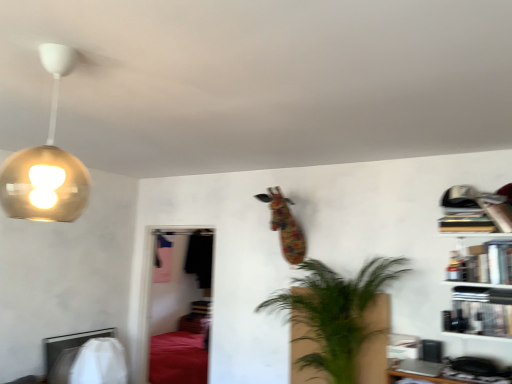
Question: Is gold metallic globe at upper left surrounded by metallic silver book at right, placed as the 1th book when sorted from bottom to top?

Choices:
 (A) yes
 (B) no

Answer: (B)

Question: Are metallic silver book at right, placed as the 1th book when sorted from bottom to top, and gold metallic globe at upper left located far from each other?

Choices:
 (A) no
 (B) yes

Answer: (B)

Question: Is gold metallic globe at upper left at the back of metallic silver book at right, placed as the 1th book when sorted from bottom to top?

Choices:
 (A) no
 (B) yes

Answer: (A)

Question: Does metallic silver book at right, placed as the 3th book when sorted from top to bottom, have a lesser height compared to gold metallic globe at upper left?

Choices:
 (A) yes
 (B) no

Answer: (A)

Question: From a real-world perspective, is metallic silver book at right, placed as the 1th book when sorted from bottom to top, over gold metallic globe at upper left?

Choices:
 (A) yes
 (B) no

Answer: (B)

Question: Can you confirm if metallic silver book at right, placed as the 3th book when sorted from top to bottom, is taller than gold metallic globe at upper left?

Choices:
 (A) no
 (B) yes

Answer: (A)

Question: From a real-world perspective, is metallic silver book at right, placed as the 3th book when sorted from top to bottom, physically below green leafy plant at center?

Choices:
 (A) yes
 (B) no

Answer: (B)

Question: Can you confirm if metallic silver book at right, placed as the 3th book when sorted from top to bottom, is shorter than green leafy plant at center?

Choices:
 (A) yes
 (B) no

Answer: (A)

Question: Is metallic silver book at right, placed as the 1th book when sorted from bottom to top, with green leafy plant at center?

Choices:
 (A) no
 (B) yes

Answer: (A)

Question: Does metallic silver book at right, placed as the 3th book when sorted from top to bottom, come in front of green leafy plant at center?

Choices:
 (A) no
 (B) yes

Answer: (A)

Question: Are metallic silver book at right, placed as the 3th book when sorted from top to bottom, and green leafy plant at center far apart?

Choices:
 (A) yes
 (B) no

Answer: (B)

Question: Is metallic silver book at right, placed as the 3th book when sorted from top to bottom, positioned behind green leafy plant at center?

Choices:
 (A) no
 (B) yes

Answer: (B)

Question: Can you confirm if hardcover books at upper right, the third book ordered from the bottom, is bigger than metallic silver book at right, placed as the 3th book when sorted from top to bottom?

Choices:
 (A) yes
 (B) no

Answer: (B)